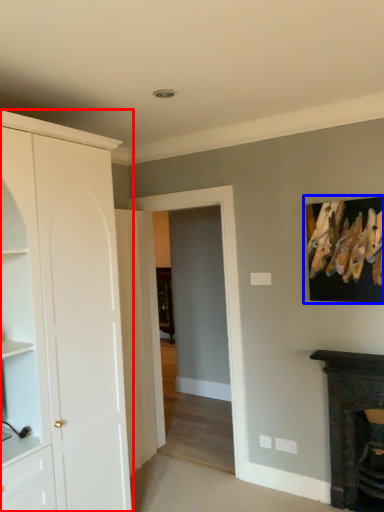
Question: Which object appears closest to the camera in this image, cabinetry (highlighted by a red box) or picture frame (highlighted by a blue box)?

Choices:
 (A) cabinetry
 (B) picture frame

Answer: (A)